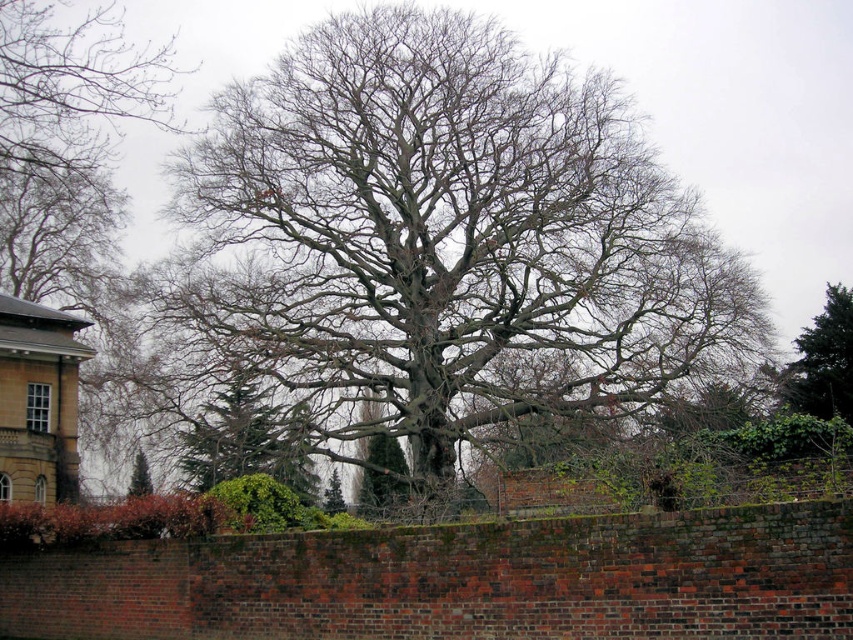
Question: Which point is closer to the camera?

Choices:
 (A) (793, 385)
 (B) (149, 476)

Answer: (A)

Question: Observing the image, what is the correct spatial positioning of bare branches at center in reference to green textured tree at center?

Choices:
 (A) above
 (B) below

Answer: (A)

Question: Estimate the real-world distances between objects in this image. Which object is closer to the green textured pine tree at center?

Choices:
 (A) green textured tree at center
 (B) bare branches at center
 (C) green leafy tree at upper right

Answer: (A)

Question: Does green textured tree at center have a larger size compared to green leafy tree at upper right?

Choices:
 (A) yes
 (B) no

Answer: (B)

Question: Is green leafy tree at upper right positioned before green textured pine tree at center?

Choices:
 (A) no
 (B) yes

Answer: (B)

Question: Which point appears closest to the camera in this image?

Choices:
 (A) (131, 483)
 (B) (434, 243)

Answer: (B)